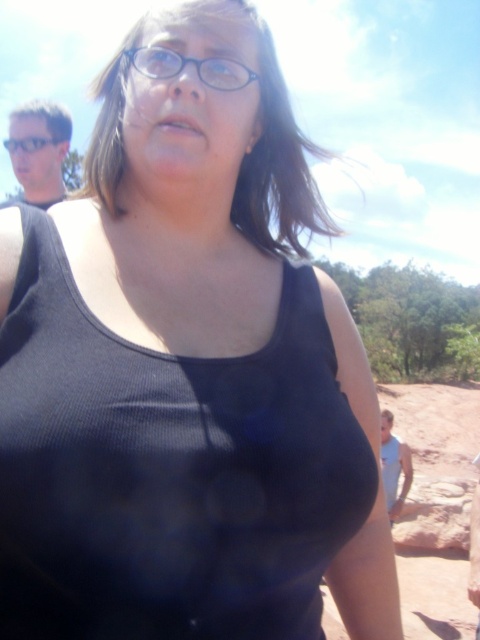
Can you confirm if black plastic glasses at center is wider than black plastic glasses at upper center?

No, black plastic glasses at center is not wider than black plastic glasses at upper center.

The image size is (480, 640). I want to click on black plastic glasses at center, so [192, 65].

Measure the distance between black plastic glasses at center and camera.

black plastic glasses at center is 28.02 inches away from camera.

I want to click on black plastic glasses at center, so click(x=192, y=65).